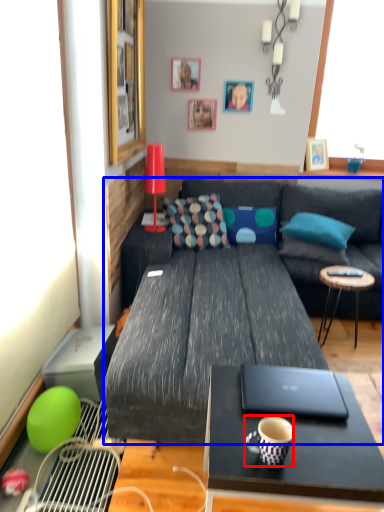
Question: Which of the following is the farthest to the observer, coffee cup (highlighted by a red box) or studio couch (highlighted by a blue box)?

Choices:
 (A) coffee cup
 (B) studio couch

Answer: (B)